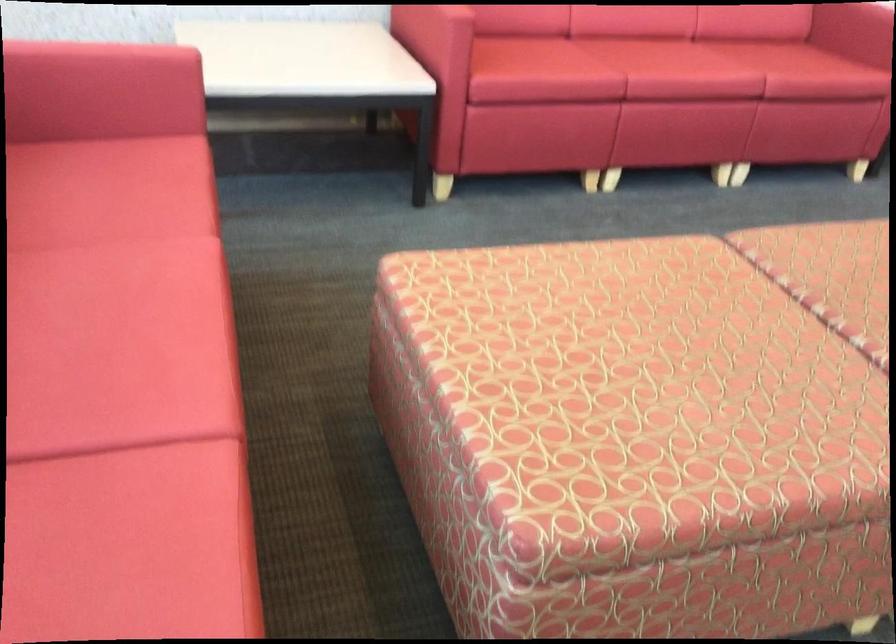
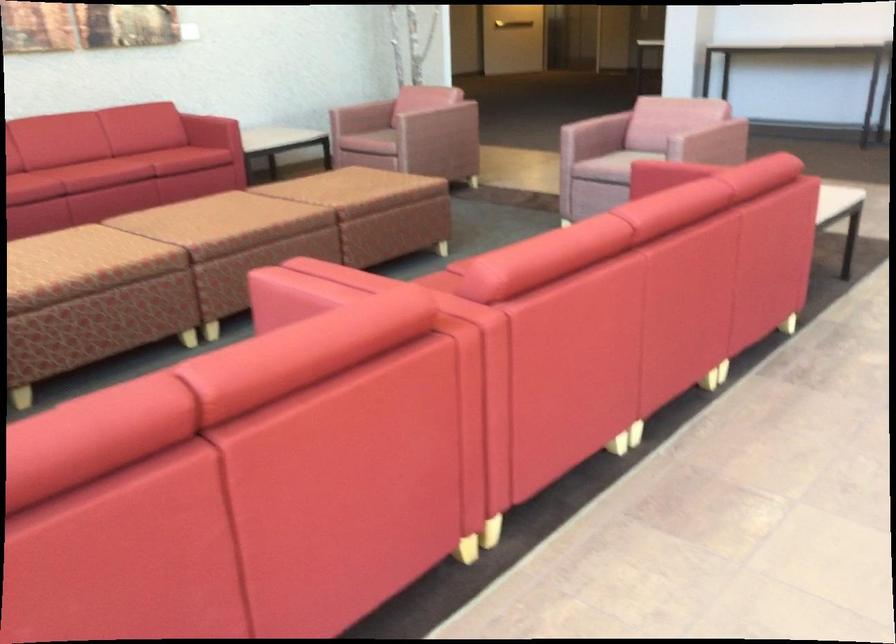
In the second image, find the point that corresponds to pixel 730 468 in the first image.

(83, 265)